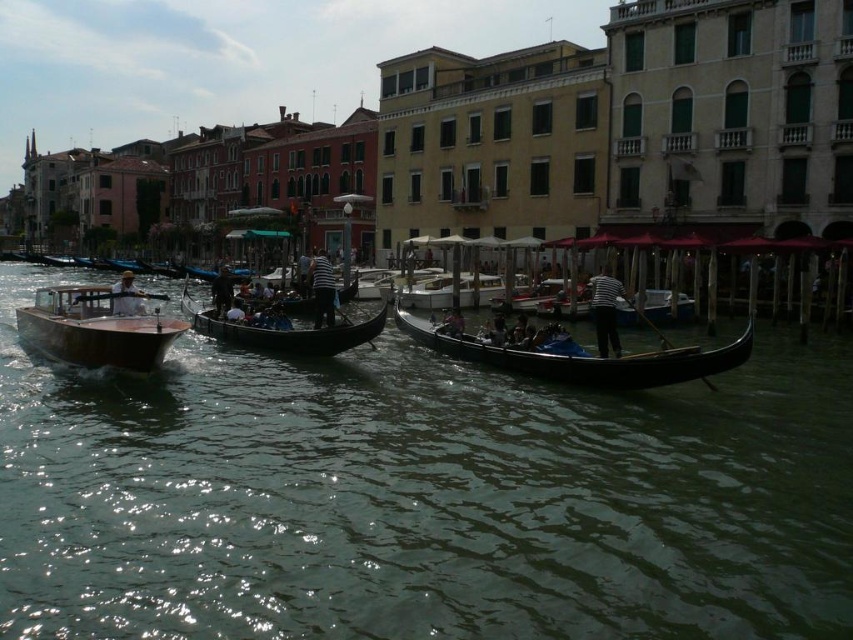
Is wooden boat at left below dark blue fabric at center?

Yes.

Which of these two, wooden boat at left or dark blue fabric at center, stands taller?

With more height is wooden boat at left.

This screenshot has width=853, height=640. I want to click on wooden boat at left, so click(x=97, y=326).

Does wooden boat at left have a lesser width compared to striped fabric shirt at center?

Incorrect, wooden boat at left's width is not less than striped fabric shirt at center's.

Is point (119, 292) closer to viewer compared to point (601, 337)?

That is False.

This screenshot has width=853, height=640. What are the coordinates of `wooden boat at left` in the screenshot? It's located at (97, 326).

Consider the image. Is clear water at boat right taller than striped fabric person at center?

Yes, clear water at boat right is taller than striped fabric person at center.

Who is more forward, (x=131, y=428) or (x=329, y=282)?

Point (x=131, y=428)

Locate an element on the screen. clear water at boat right is located at coordinates (418, 497).